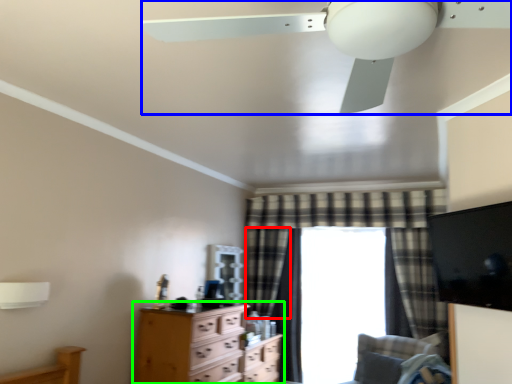
Question: Which object is positioned farthest from curtain (highlighted by a red box)? Select from ceiling fan (highlighted by a blue box) and chest of drawers (highlighted by a green box).

Choices:
 (A) ceiling fan
 (B) chest of drawers

Answer: (A)